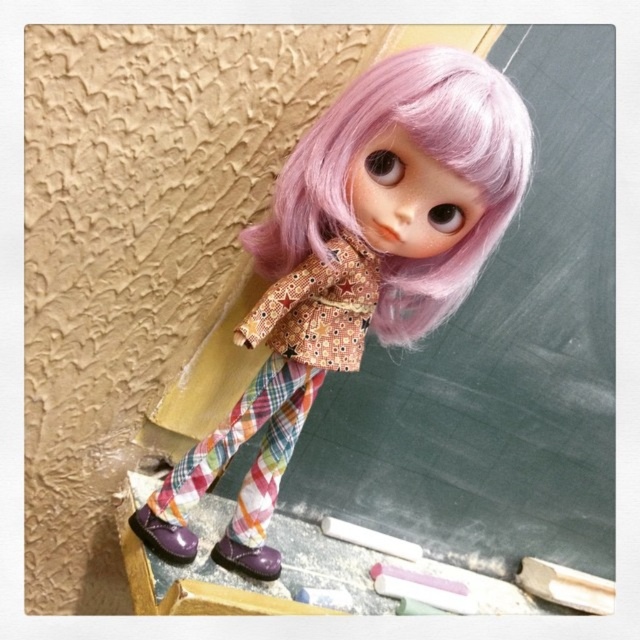
Looking at this image, you are a student in the classroom and want to pick up the purple matte shoe at lower center without touching the matte fabric doll at center. Can you reach it easily?

The matte fabric doll at center is positioned on the right side of the purple matte shoe at lower center, so you can reach the purple matte shoe at lower center easily without touching the doll.

You are a student in the classroom and want to know if the pastel pink wig at upper center can fit into a box that is the same size as the purple matte shoe at lower center. Can it fit?

The pastel pink wig at upper center is wider than the purple matte shoe at lower center, so it cannot fit into a box the same size as the purple matte shoe at lower center.

You are a student in the classroom and need to place a 20 inch ruler between the pastel pink wig at upper center and the shiny purple shoe at lower left. Can you fit the ruler between them without bending it?

The distance between the pastel pink wig at upper center and the shiny purple shoe at lower left is 24.09 inches, so yes, the ruler can fit between them without bending since it is shorter than the distance.